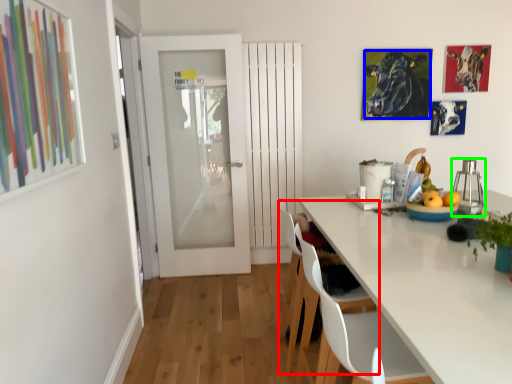
Question: Which is farther away from chair (highlighted by a red box)? cattle (highlighted by a blue box) or appliance (highlighted by a green box)?

Choices:
 (A) cattle
 (B) appliance

Answer: (A)